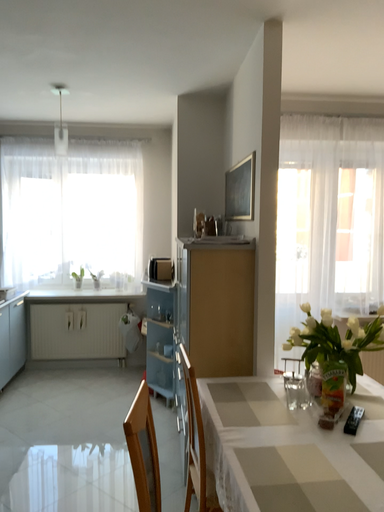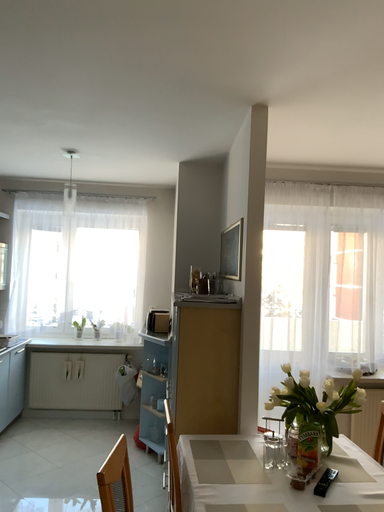
Question: Which way did the camera rotate in the video?

Choices:
 (A) rotated downward
 (B) rotated upward

Answer: (B)